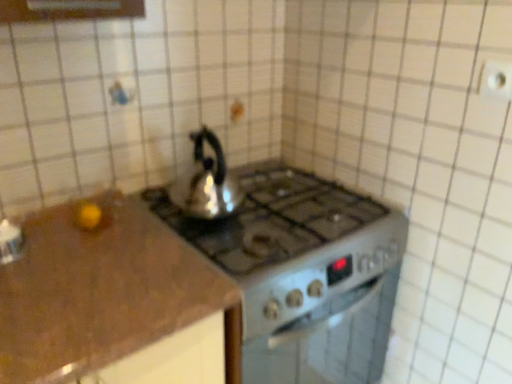
Identify the location of vacant region to the right of shiny metallic kettle at center. The height and width of the screenshot is (384, 512). (283, 220).